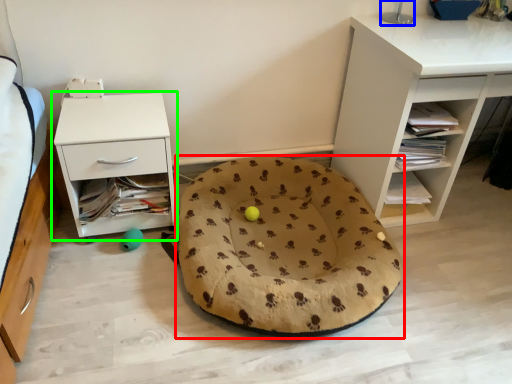
Question: Estimate the real-world distances between objects in this image. Which object is closer to dog bed (highlighted by a red box), table lamp (highlighted by a blue box) or nightstand (highlighted by a green box)?

Choices:
 (A) table lamp
 (B) nightstand

Answer: (B)